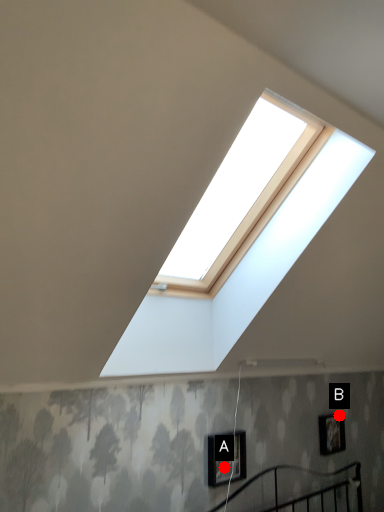
Question: Two points are circled on the image, labeled by A and B beside each circle. Which of the following is the farthest from the observer?

Choices:
 (A) A is further
 (B) B is further

Answer: (B)